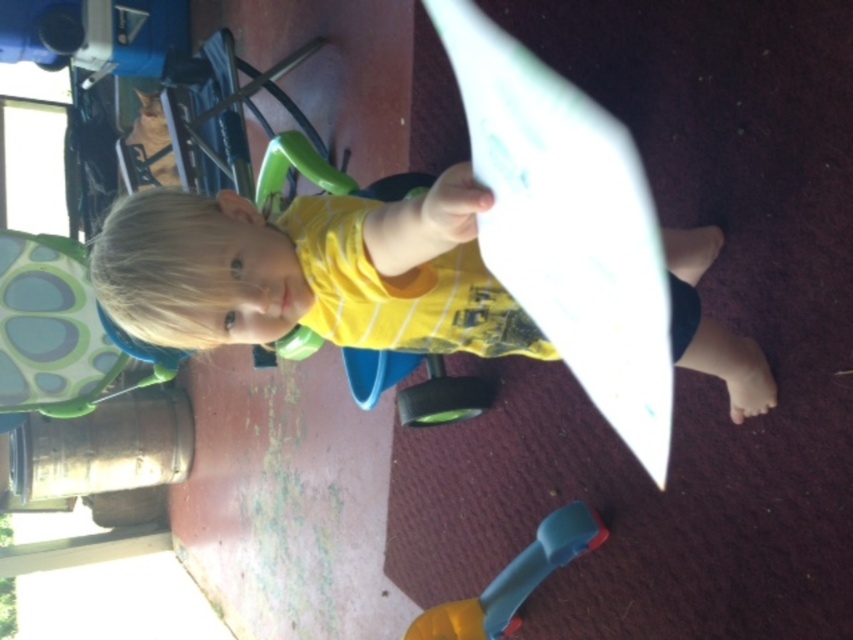
Question: Which object is farther from the camera taking this photo?

Choices:
 (A) blue plastic toy at lower center
 (B) yellow cotton shirt at center

Answer: (A)

Question: Which point is closer to the camera?

Choices:
 (A) (674, 307)
 (B) (444, 605)

Answer: (A)

Question: Can you confirm if yellow cotton shirt at center is positioned below blue plastic toy at lower center?

Choices:
 (A) yes
 (B) no

Answer: (B)

Question: Is yellow cotton shirt at center smaller than blue plastic toy at lower center?

Choices:
 (A) no
 (B) yes

Answer: (A)

Question: Which point is closer to the camera?

Choices:
 (A) (480, 612)
 (B) (322, 236)

Answer: (B)

Question: Can you confirm if yellow cotton shirt at center is positioned below blue plastic toy at lower center?

Choices:
 (A) no
 (B) yes

Answer: (A)